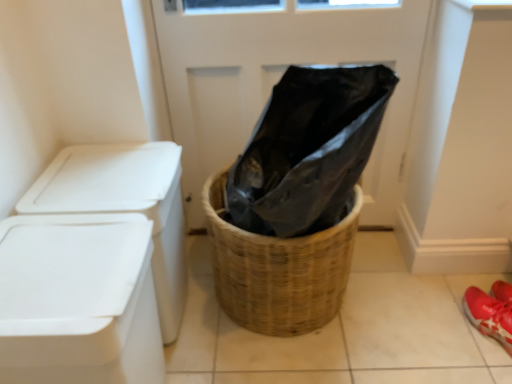
Where is `vacant space to the right of woven brown basket at center`? vacant space to the right of woven brown basket at center is located at coordinates [404, 308].